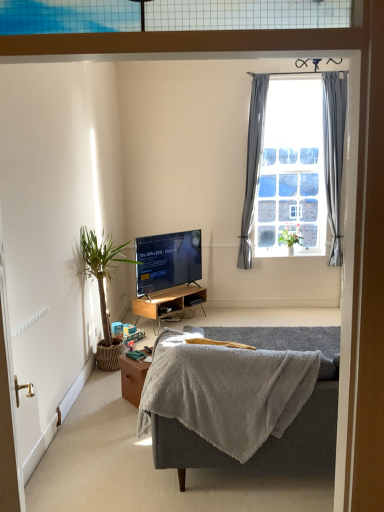
Question: Is clear glass window at upper right turned away from green leafy plant at window, positioned as the first houseplant in back-to-front order?

Choices:
 (A) yes
 (B) no

Answer: (A)

Question: From a real-world perspective, does clear glass window at upper right sit lower than green leafy plant at window, which is the 2th houseplant from left to right?

Choices:
 (A) no
 (B) yes

Answer: (A)

Question: Is clear glass window at upper right bigger than green leafy plant at window, the second houseplant when ordered from front to back?

Choices:
 (A) yes
 (B) no

Answer: (A)

Question: From the image's perspective, is clear glass window at upper right located beneath green leafy plant at window, which is the 2th houseplant from left to right?

Choices:
 (A) no
 (B) yes

Answer: (A)

Question: Can you confirm if clear glass window at upper right is positioned to the left of green leafy plant at window, positioned as the first houseplant in back-to-front order?

Choices:
 (A) no
 (B) yes

Answer: (B)

Question: Is matte black tv at center situated inside woodenmaterial/texturedesk at center or outside?

Choices:
 (A) outside
 (B) inside

Answer: (A)

Question: Relative to woodenmaterial/texturedesk at center, is matte black tv at center in front or behind?

Choices:
 (A) front
 (B) behind

Answer: (A)

Question: In the image, is matte black tv at center on the left side or the right side of woodenmaterial/texturedesk at center?

Choices:
 (A) right
 (B) left

Answer: (B)

Question: Is point (195, 266) closer or farther from the camera than point (170, 288)?

Choices:
 (A) farther
 (B) closer

Answer: (A)

Question: From a real-world perspective, relative to gray fabric curtain at upper right, which is counted as the second curtain, starting from the left, is green leafy plant at left, the 2th houseplant viewed from the right, vertically above or below?

Choices:
 (A) below
 (B) above

Answer: (A)

Question: Is green leafy plant at left, which appears as the 1th houseplant when viewed from the front, inside or outside of gray fabric curtain at upper right, the 1th curtain positioned from the right?

Choices:
 (A) inside
 (B) outside

Answer: (B)

Question: Is point (109, 247) closer or farther from the camera than point (331, 160)?

Choices:
 (A) farther
 (B) closer

Answer: (B)

Question: Looking at their shapes, would you say green leafy plant at left, which ranks as the first houseplant in left-to-right order, is wider or thinner than gray fabric curtain at upper right, which is counted as the second curtain, starting from the left?

Choices:
 (A) wide
 (B) thin

Answer: (A)

Question: In the image, is brown wooden table at lower center positioned in front of or behind gray plush couch at center?

Choices:
 (A) front
 (B) behind

Answer: (B)

Question: Is brown wooden table at lower center taller or shorter than gray plush couch at center?

Choices:
 (A) tall
 (B) short

Answer: (B)